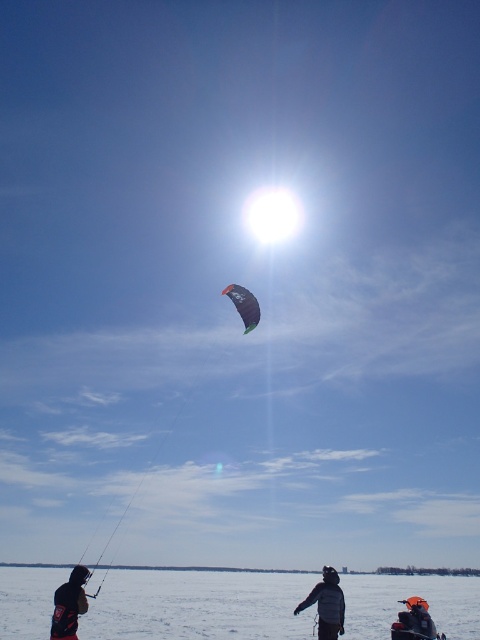
Who is shorter, dark gray jacket at center or dark gray jacket at lower left?

With less height is dark gray jacket at lower left.

Is dark gray jacket at center wider than dark gray jacket at lower left?

Incorrect, dark gray jacket at center's width does not surpass dark gray jacket at lower left's.

Is point (340, 600) less distant than point (72, 605)?

No, (340, 600) is further to viewer.

Where is `dark gray jacket at center`? The height and width of the screenshot is (640, 480). dark gray jacket at center is located at coordinates click(326, 604).

Is white snow at lower center shorter than dark gray jacket at lower left?

No, white snow at lower center is not shorter than dark gray jacket at lower left.

Between white snow at lower center and dark gray jacket at lower left, which one is positioned lower?

Positioned lower is white snow at lower center.

This screenshot has height=640, width=480. What do you see at coordinates (199, 605) in the screenshot?
I see `white snow at lower center` at bounding box center [199, 605].

Image resolution: width=480 pixels, height=640 pixels. I want to click on white snow at lower center, so click(x=199, y=605).

Does dark gray jacket at center have a greater width compared to green matte parachute at center?

No, dark gray jacket at center is not wider than green matte parachute at center.

Does point (310, 596) lie in front of point (243, 324)?

Yes, point (310, 596) is in front of point (243, 324).

Find the location of a particular element. The width and height of the screenshot is (480, 640). dark gray jacket at center is located at coordinates (326, 604).

You are a GUI agent. You are given a task and a screenshot of the screen. Output one action in this format:
    pyautogui.click(x=<x>, y=<y>)
    Task: Click on the dark gray jacket at center
    The width and height of the screenshot is (480, 640).
    Given the screenshot: What is the action you would take?
    point(326,604)